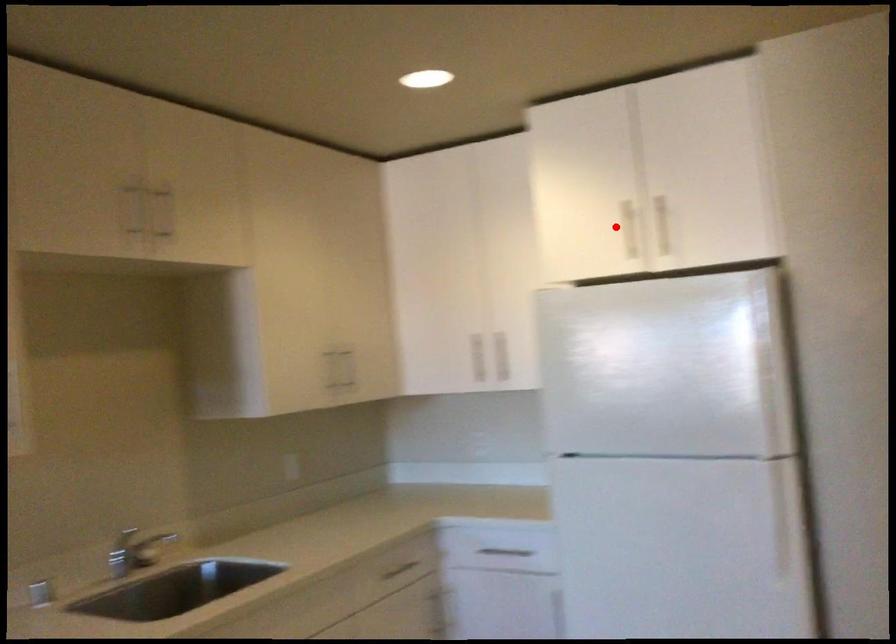
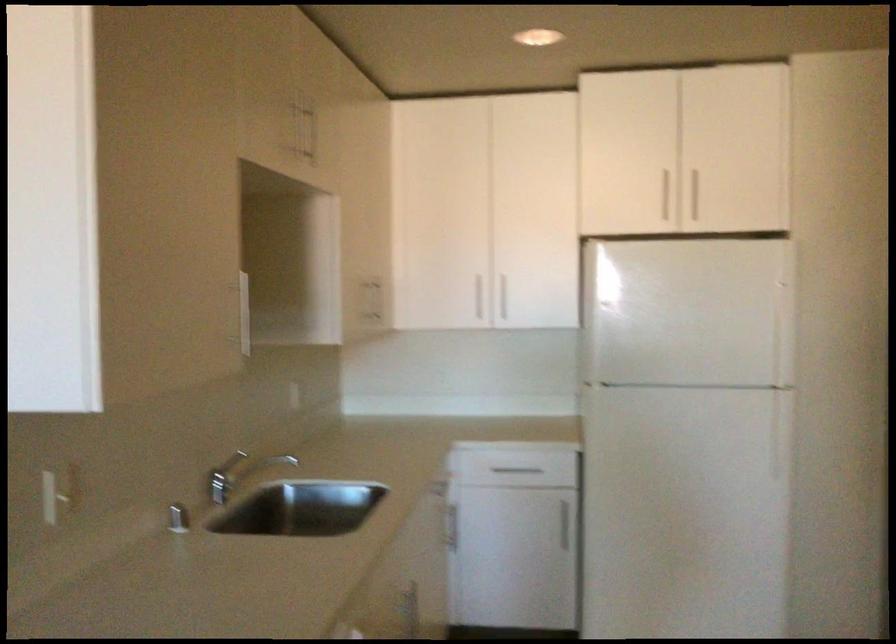
Locate, in the second image, the point that corresponds to the highlighted location in the first image.

(661, 194)